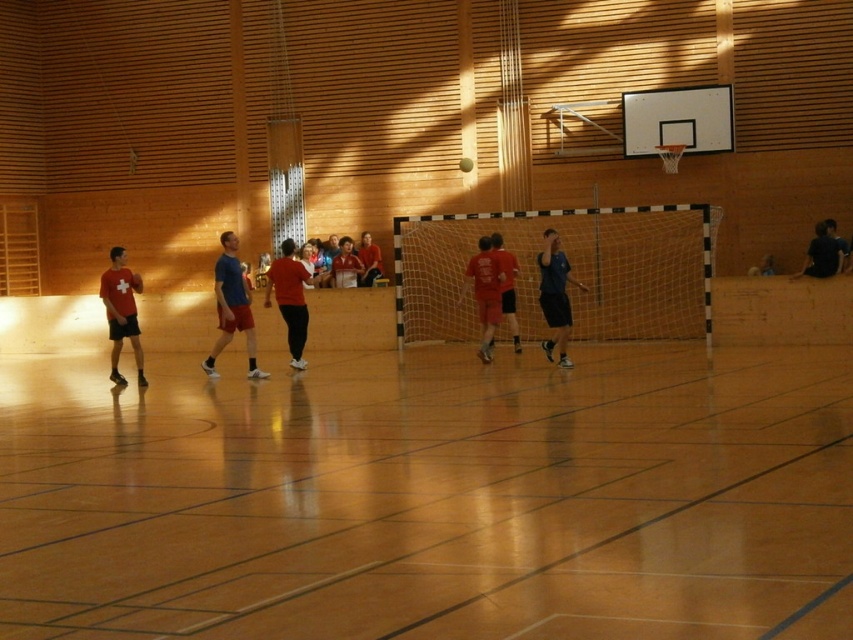
Does wooden floor at center come in front of blue fabric shirt at center?

Yes.

At what (x,y) coordinates should I click in order to perform the action: click on wooden floor at center. Please return your answer as a coordinate pair (x, y). Looking at the image, I should click on (433, 499).

Find the location of `wooden floor at center`. wooden floor at center is located at coordinates (433, 499).

Which is more to the left, matte red shirt at left or matte red shirts at center?

matte red shirt at left

Who is taller, matte red shirt at left or matte red shirts at center?

matte red shirt at left

You are a GUI agent. You are given a task and a screenshot of the screen. Output one action in this format:
    pyautogui.click(x=<x>, y=<y>)
    Task: Click on the matte red shirt at left
    The height and width of the screenshot is (640, 853).
    Given the screenshot: What is the action you would take?
    pyautogui.click(x=120, y=312)

You are a GUI agent. You are given a task and a screenshot of the screen. Output one action in this format:
    pyautogui.click(x=<x>, y=<y>)
    Task: Click on the matte red shirt at left
    Image resolution: width=853 pixels, height=640 pixels.
    Given the screenshot: What is the action you would take?
    pyautogui.click(x=120, y=312)

In the scene shown: Who is taller, blue fabric shirt at center or matte red shirts at center?

With more height is blue fabric shirt at center.

Does blue fabric shirt at center have a greater height compared to matte red shirts at center?

Yes, blue fabric shirt at center is taller than matte red shirts at center.

This screenshot has height=640, width=853. I want to click on blue fabric shirt at center, so click(555, 296).

Find the location of a particular element. The height and width of the screenshot is (640, 853). blue fabric shirt at center is located at coordinates (555, 296).